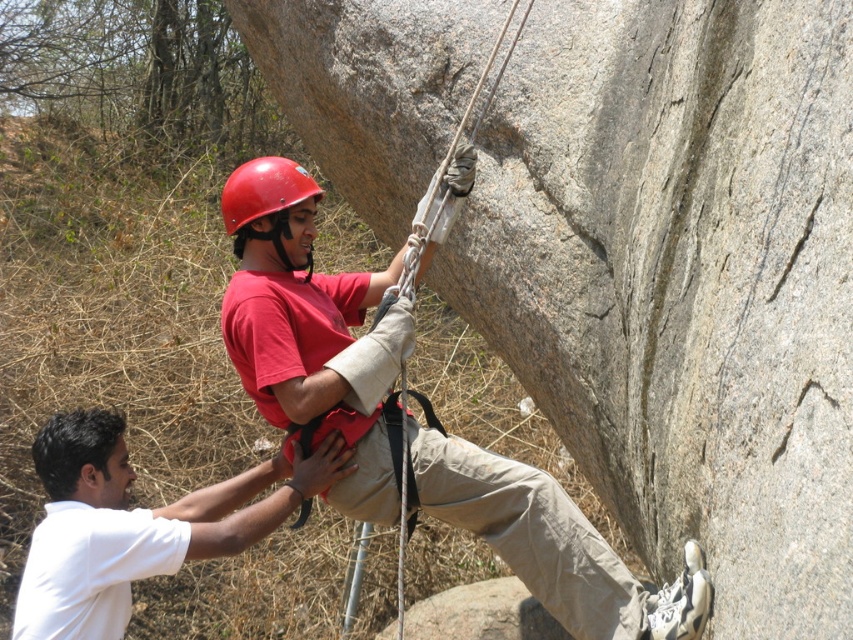
Question: Among these points, which one is nearest to the camera?

Choices:
 (A) click(131, 534)
 (B) click(334, 356)
 (C) click(254, 168)

Answer: (A)

Question: Is the position of matte red helmet at upper center more distant than that of white matte shirt at lower left?

Choices:
 (A) no
 (B) yes

Answer: (A)

Question: Is matte red helmet at upper center further to the viewer compared to matte red helmet at center?

Choices:
 (A) yes
 (B) no

Answer: (B)

Question: Considering the real-world distances, which object is closest to the white matte shirt at lower left?

Choices:
 (A) matte red helmet at center
 (B) matte red helmet at upper center

Answer: (B)

Question: Can you confirm if matte red helmet at upper center is positioned above matte red helmet at center?

Choices:
 (A) no
 (B) yes

Answer: (A)

Question: Which object appears farthest from the camera in this image?

Choices:
 (A) matte red helmet at upper center
 (B) matte red helmet at center

Answer: (B)